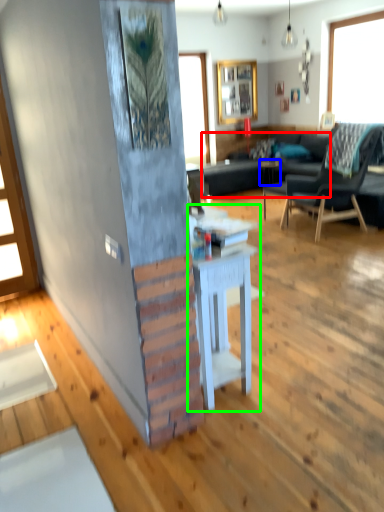
Question: Which object is positioned closest to studio couch (highlighted by a red box)? Select from side table (highlighted by a blue box) and table (highlighted by a green box).

Choices:
 (A) side table
 (B) table

Answer: (A)